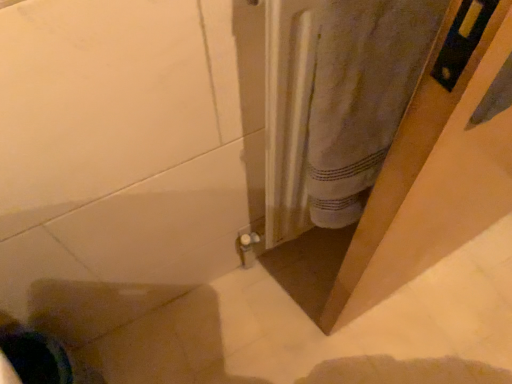
Find the location of a particular element. white fabric at upper right is located at coordinates (430, 180).

What do you see at coordinates (430, 180) in the screenshot? The height and width of the screenshot is (384, 512). I see `white fabric at upper right` at bounding box center [430, 180].

What is the approximate width of white fabric at upper right?

white fabric at upper right is 8.16 inches in width.

Where is `white fabric at upper right`? The image size is (512, 384). white fabric at upper right is located at coordinates (430, 180).